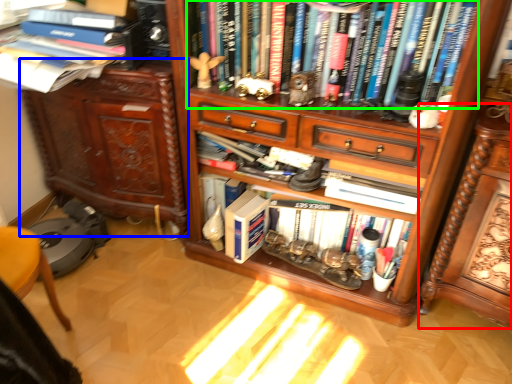
Question: Which object is positioned closest to computer desk (highlighted by a red box)? Select from cabinetry (highlighted by a blue box) and book (highlighted by a green box).

Choices:
 (A) cabinetry
 (B) book

Answer: (B)